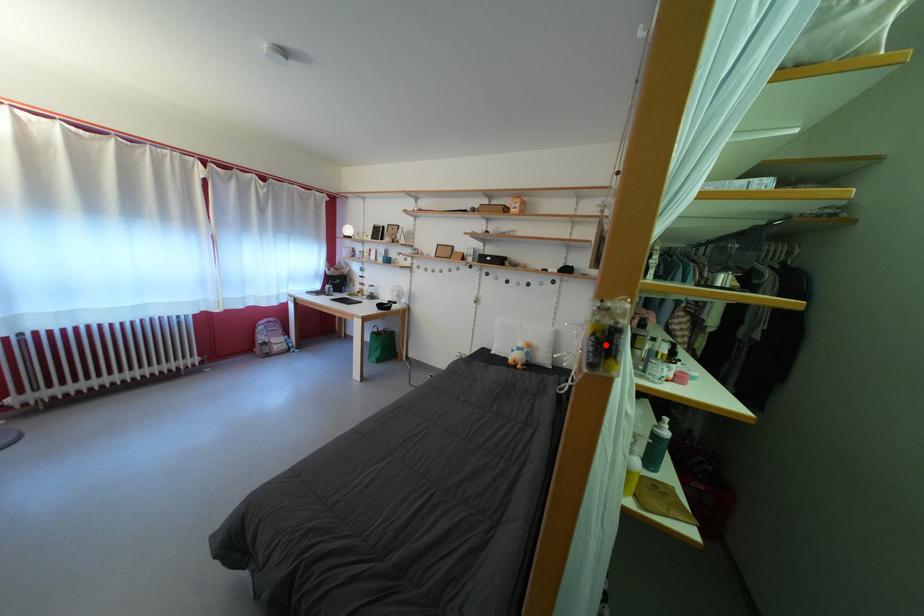
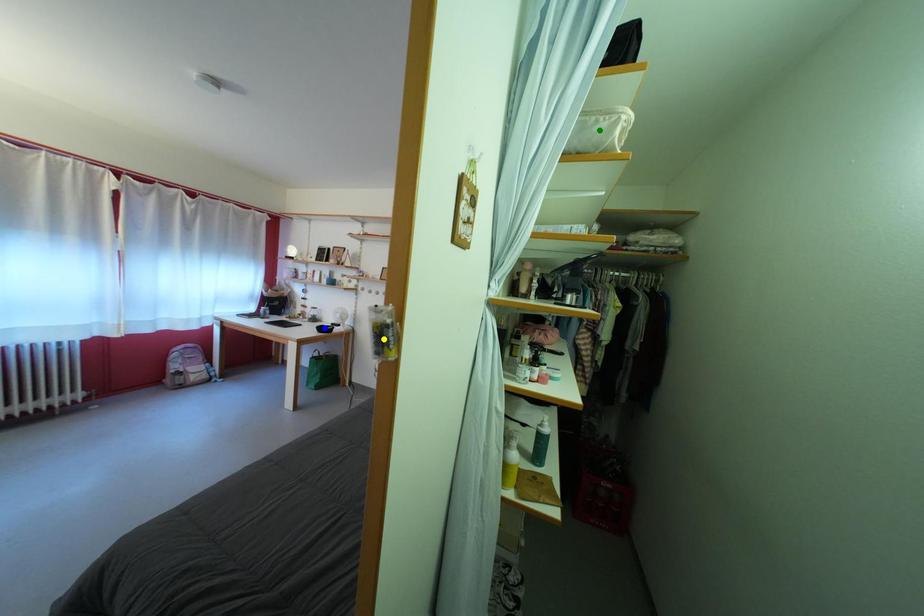
Question: I am providing you with two images of the same scene from different viewpoints. A red point is marked on the first image. You are given multiple points on the second image. Which spot in image 2 lines up with the point in image 1?

Choices:
 (A) yellow point
 (B) green point
 (C) blue point

Answer: (A)